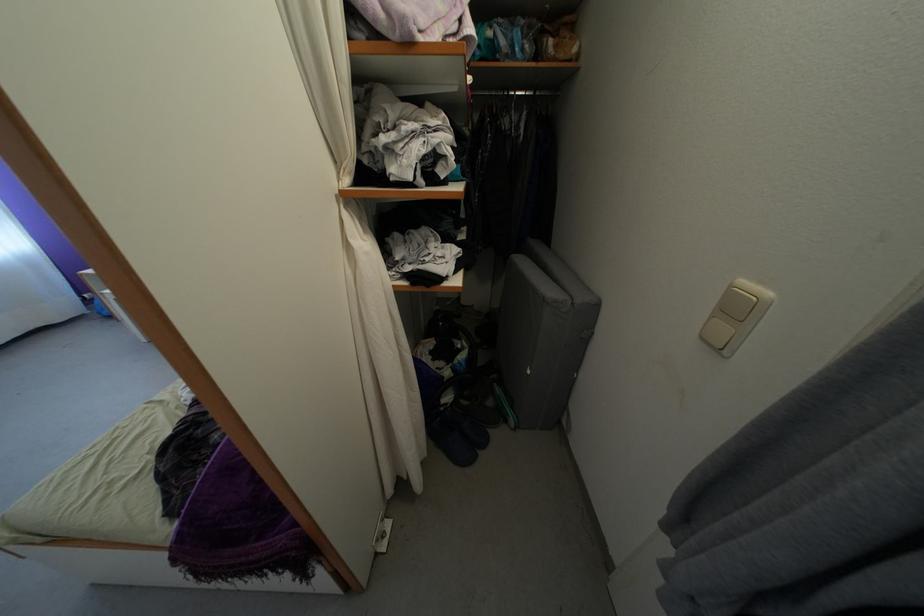
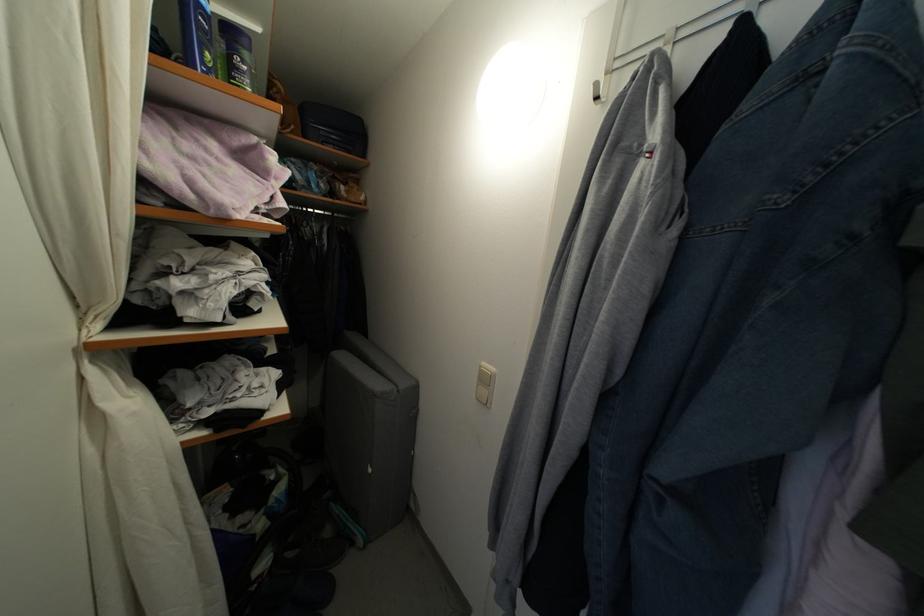
Question: The camera is either moving clockwise (left) or counter-clockwise (right) around the object. The first image is from the beginning of the video and the second image is from the end. Is the camera moving left or right when shooting the video?

Choices:
 (A) Left
 (B) Right

Answer: (A)